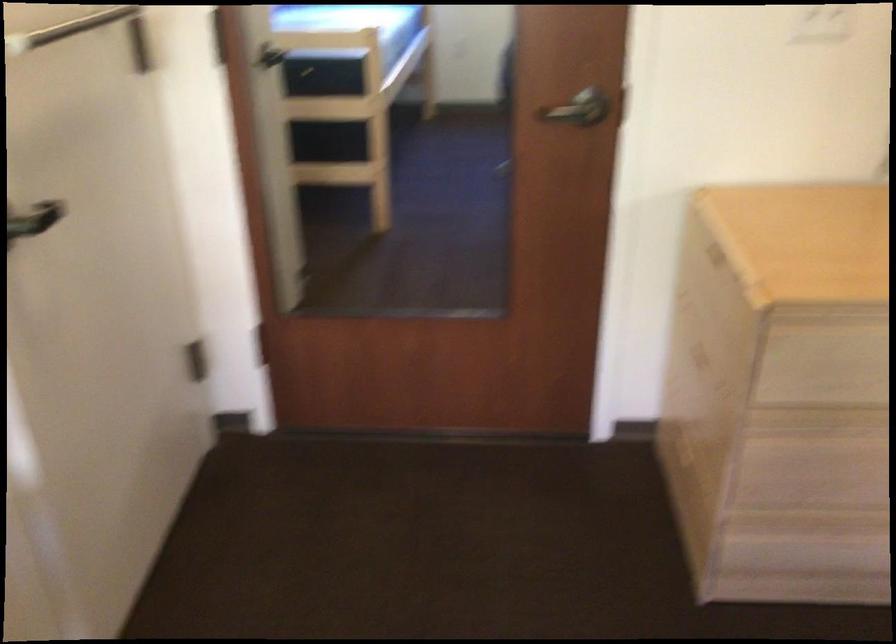
The width and height of the screenshot is (896, 644). What do you see at coordinates (195, 357) in the screenshot? I see `the white light switch` at bounding box center [195, 357].